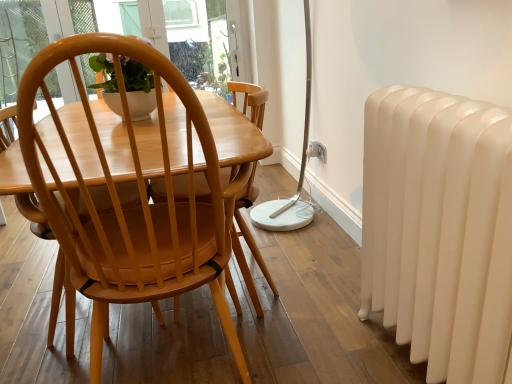
Question: Considering the relative sizes of matte wood chair at center and white glossy radiator at right in the image provided, is matte wood chair at center taller than white glossy radiator at right?

Choices:
 (A) no
 (B) yes

Answer: (B)

Question: Is matte wood chair at center facing towards white glossy radiator at right?

Choices:
 (A) yes
 (B) no

Answer: (B)

Question: Does matte wood chair at center appear on the left side of white glossy radiator at right?

Choices:
 (A) yes
 (B) no

Answer: (A)

Question: Would you say matte wood chair at center is a long distance from white glossy radiator at right?

Choices:
 (A) no
 (B) yes

Answer: (A)

Question: Is matte wood chair at center located outside white glossy radiator at right?

Choices:
 (A) no
 (B) yes

Answer: (B)

Question: Is white plastic power outlet at lower center bigger or smaller than matte wood chair at center?

Choices:
 (A) small
 (B) big

Answer: (A)

Question: From a real-world perspective, is white plastic power outlet at lower center above or below matte wood chair at center?

Choices:
 (A) above
 (B) below

Answer: (B)

Question: Is white plastic power outlet at lower center situated inside matte wood chair at center or outside?

Choices:
 (A) outside
 (B) inside

Answer: (A)

Question: Is white plastic power outlet at lower center taller or shorter than matte wood chair at center?

Choices:
 (A) tall
 (B) short

Answer: (B)

Question: Considering the positions of matte wood chair at center and white plastic electric outlet at center in the image, is matte wood chair at center bigger or smaller than white plastic electric outlet at center?

Choices:
 (A) big
 (B) small

Answer: (A)

Question: From a real-world perspective, is matte wood chair at center physically located above or below white plastic electric outlet at center?

Choices:
 (A) below
 (B) above

Answer: (B)

Question: Considering the positions of matte wood chair at center and white plastic electric outlet at center in the image, is matte wood chair at center wider or thinner than white plastic electric outlet at center?

Choices:
 (A) wide
 (B) thin

Answer: (A)

Question: In the image, is matte wood chair at center positioned in front of or behind white plastic electric outlet at center?

Choices:
 (A) front
 (B) behind

Answer: (A)

Question: From a real-world perspective, relative to matte wood chair at center, is white plastic electric outlet at center vertically above or below?

Choices:
 (A) above
 (B) below

Answer: (B)

Question: Considering the positions of point (313, 150) and point (146, 61), is point (313, 150) closer or farther from the camera than point (146, 61)?

Choices:
 (A) farther
 (B) closer

Answer: (A)